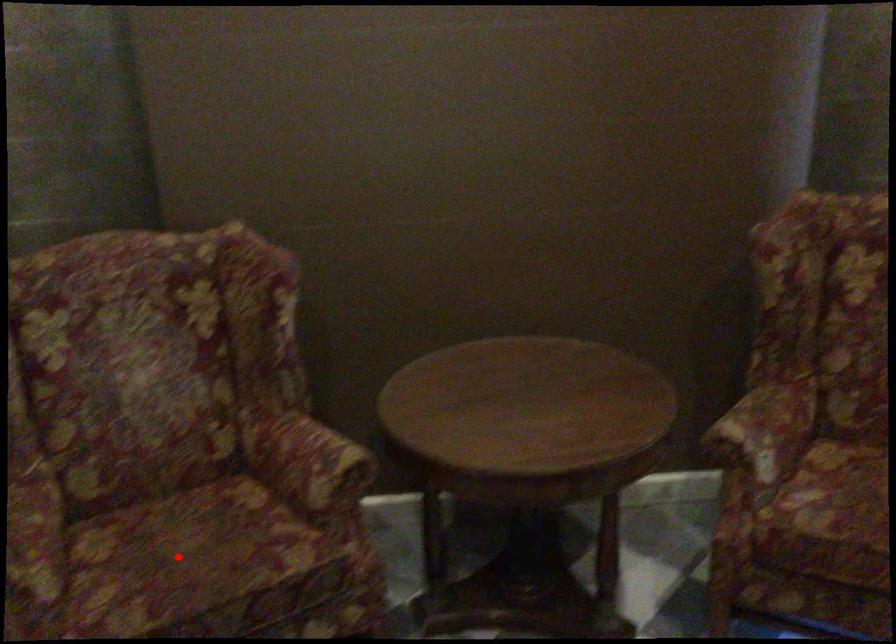
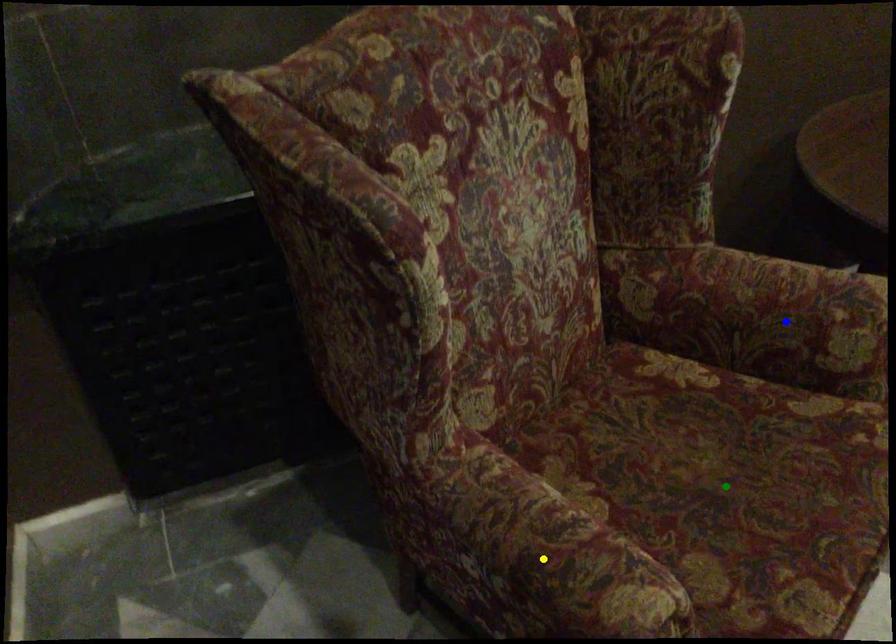
Question: I am providing you with two images of the same scene from different viewpoints. A red point is marked on the first image. You are given multiple points on the second image. Which mark in image 2 goes with the point in image 1?

Choices:
 (A) green point
 (B) yellow point
 (C) blue point

Answer: (A)